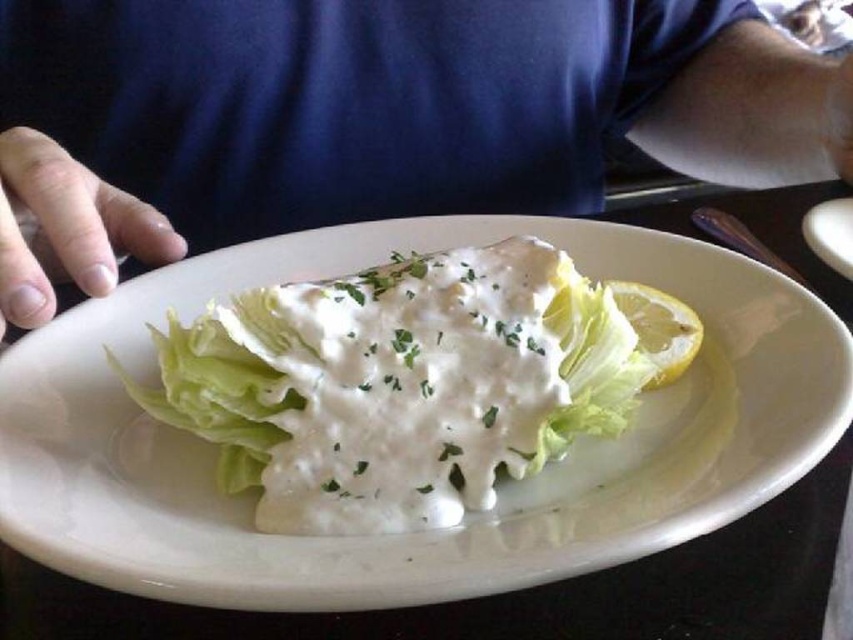
Question: Can you confirm if green leafy lettuce at center is bigger than yellow smooth lemon at upper right?

Choices:
 (A) yes
 (B) no

Answer: (A)

Question: Can you confirm if blue fabric shirt at upper center is positioned above green leafy lettuce at center?

Choices:
 (A) no
 (B) yes

Answer: (B)

Question: Which is farther from the yellow smooth lemon at upper right?

Choices:
 (A) green leafy lettuce at center
 (B) blue fabric shirt at upper center

Answer: (B)

Question: Is blue fabric shirt at upper center below yellow smooth lemon at upper right?

Choices:
 (A) no
 (B) yes

Answer: (A)

Question: Estimate the real-world distances between objects in this image. Which object is closer to the green leafy lettuce at center?

Choices:
 (A) yellow smooth lemon at upper right
 (B) blue fabric shirt at upper center

Answer: (A)

Question: Which of the following is the closest to the observer?

Choices:
 (A) (503, 355)
 (B) (309, 86)

Answer: (A)